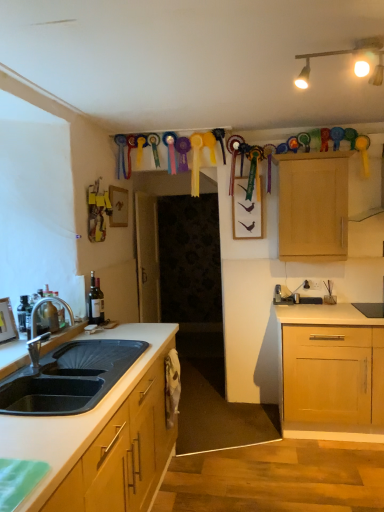
This screenshot has height=512, width=384. In order to click on wooden picture frame at left in this screenshot , I will do `click(7, 321)`.

Identify the location of light wood cabinet at upper right. (313, 206).

What is the approximate height of brushed metal faucet at sink left?

It is 13.83 inches.

Measure the distance between point (359, 67) and camera.

Point (359, 67) and camera are 6.67 feet apart from each other.

The height and width of the screenshot is (512, 384). I want to click on wooden picture frame at left, so click(x=7, y=321).

Consider the image. Is wooden picture frame at left facing towards brushed metal faucet at sink left?

Yes, wooden picture frame at left faces towards brushed metal faucet at sink left.

Is point (6, 339) more distant than point (70, 315)?

No.

Is wooden picture frame at left thinner than brushed metal faucet at sink left?

Correct, the width of wooden picture frame at left is less than that of brushed metal faucet at sink left.

Would you say wooden picture frame at left contains brushed metal faucet at sink left?

No, brushed metal faucet at sink left is not surrounded by wooden picture frame at left.

Does matte gold track lights at upper center turn towards brushed metal faucet at sink left?

No, matte gold track lights at upper center is not turned towards brushed metal faucet at sink left.

Does matte gold track lights at upper center have a smaller size compared to brushed metal faucet at sink left?

Actually, matte gold track lights at upper center might be larger than brushed metal faucet at sink left.

Can you confirm if matte gold track lights at upper center is shorter than brushed metal faucet at sink left?

Yes, matte gold track lights at upper center is shorter than brushed metal faucet at sink left.

Is matte gold track lights at upper center not near brushed metal faucet at sink left?

Yes.

How different are the orientations of matte gold track lights at upper center and wooden picture frame at left in degrees?

10.5 degrees separate the facing orientations of matte gold track lights at upper center and wooden picture frame at left.

Considering the positions of objects matte gold track lights at upper center and wooden picture frame at left in the image provided, who is more to the right, matte gold track lights at upper center or wooden picture frame at left?

matte gold track lights at upper center is more to the right.

You are a GUI agent. You are given a task and a screenshot of the screen. Output one action in this format:
    pyautogui.click(x=<x>, y=<y>)
    Task: Click on the picture frame lying behind the matte gold track lights at upper center
    
    Given the screenshot: What is the action you would take?
    pyautogui.click(x=7, y=321)

From a real-world perspective, is matte gold track lights at upper center physically below wooden picture frame at left?

No, from a real-world perspective, matte gold track lights at upper center is not beneath wooden picture frame at left.

In terms of size, does light wood cabinet at upper right appear bigger or smaller than brushed metal faucet at sink left?

light wood cabinet at upper right is bigger than brushed metal faucet at sink left.

Is there a large distance between light wood cabinet at upper right and brushed metal faucet at sink left?

Absolutely, light wood cabinet at upper right is distant from brushed metal faucet at sink left.

Is light wood cabinet at upper right not inside brushed metal faucet at sink left?

light wood cabinet at upper right lies outside brushed metal faucet at sink left's area.

Which of these two, light wood cabinet at upper right or wooden picture frame at left, is smaller?

wooden picture frame at left.

Is the depth of light wood cabinet at upper right greater than that of wooden picture frame at left?

Yes, the depth of light wood cabinet at upper right is greater than that of wooden picture frame at left.

Is light wood cabinet at upper right inside the boundaries of wooden picture frame at left, or outside?

light wood cabinet at upper right is outside wooden picture frame at left.

Does point (32, 315) lie behind point (374, 73)?

Yes.

Identify the location of tap that is below the matte gold track lights at upper center (from the image's perspective). The height and width of the screenshot is (512, 384). (45, 332).

In terms of size, does brushed metal faucet at sink left appear bigger or smaller than matte gold track lights at upper center?

Clearly, brushed metal faucet at sink left is smaller in size than matte gold track lights at upper center.

Is brushed metal faucet at sink left not inside matte gold track lights at upper center?

Yes.

Which object is further away from the camera, wooden picture frame at left or light wood cabinet at upper right?

light wood cabinet at upper right.

Based on the photo, between wooden picture frame at left and light wood cabinet at upper right, which one has larger width?

Wider between the two is light wood cabinet at upper right.

This screenshot has width=384, height=512. What are the coordinates of `cabinetry above the wooden picture frame at left (from a real-world perspective)` in the screenshot? It's located at (313, 206).

Where is `picture frame located behind the brushed metal faucet at sink left`? picture frame located behind the brushed metal faucet at sink left is located at coordinates (7, 321).

The width and height of the screenshot is (384, 512). I want to click on lamp in front of the brushed metal faucet at sink left, so click(x=345, y=54).

When comparing their distances from wooden picture frame at left, does brushed metal faucet at sink left or matte gold track lights at upper center seem closer?

brushed metal faucet at sink left.

When comparing their distances from brushed metal faucet at sink left, does wooden picture frame at left or matte gold track lights at upper center seem further?

matte gold track lights at upper center.

From the image, which object appears to be nearer to wooden picture frame at left, matte gold track lights at upper center or brushed metal faucet at sink left?

Among the two, brushed metal faucet at sink left is located nearer to wooden picture frame at left.

From the image, which object appears to be nearer to wooden picture frame at left, matte gold track lights at upper center or light wood cabinet at upper right?

matte gold track lights at upper center.

When comparing their distances from brushed metal faucet at sink left, does wooden picture frame at left or light wood cabinet at upper right seem closer?

wooden picture frame at left.

Looking at the image, which one is located further to wooden picture frame at left, light wood cabinet at upper right or matte gold track lights at upper center?

light wood cabinet at upper right is positioned further to the anchor wooden picture frame at left.

Estimate the real-world distances between objects in this image. Which object is further from matte gold track lights at upper center, light wood cabinet at upper right or wooden picture frame at left?

The object further to matte gold track lights at upper center is wooden picture frame at left.

Based on their spatial positions, is light wood cabinet at upper right or brushed metal faucet at sink left further from matte gold track lights at upper center?

brushed metal faucet at sink left is further to matte gold track lights at upper center.

Locate an element on the screen. This screenshot has height=512, width=384. lamp between brushed metal faucet at sink left and light wood cabinet at upper right in the horizontal direction is located at coordinates (345, 54).

I want to click on tap located between wooden picture frame at left and light wood cabinet at upper right in the left-right direction, so click(x=45, y=332).

Find the location of a particular element. tap situated between wooden picture frame at left and matte gold track lights at upper center from left to right is located at coordinates (45, 332).

The width and height of the screenshot is (384, 512). What are the coordinates of `lamp between wooden picture frame at left and light wood cabinet at upper right from left to right` in the screenshot? It's located at (345, 54).